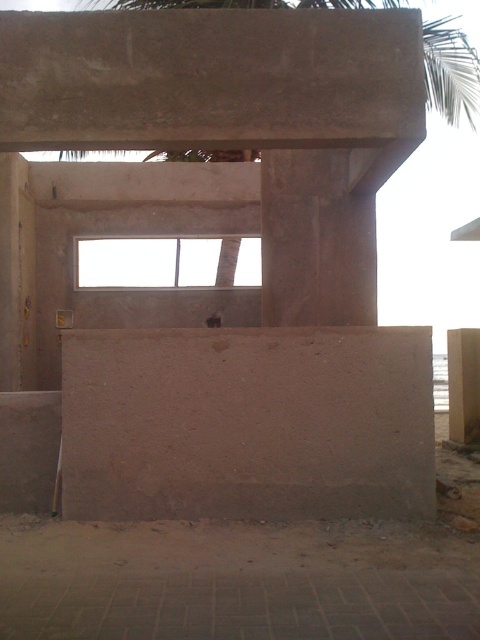
Which is above, smooth concrete wall at center or matte concrete window at center?

matte concrete window at center

Can you confirm if smooth concrete wall at center is smaller than matte concrete window at center?

No.

Image resolution: width=480 pixels, height=640 pixels. What do you see at coordinates (248, 422) in the screenshot?
I see `smooth concrete wall at center` at bounding box center [248, 422].

Identify the location of smooth concrete wall at center. (248, 422).

Can you confirm if green leafy palm tree at upper center is taller than brown concrete pillar at right?

Correct, green leafy palm tree at upper center is much taller as brown concrete pillar at right.

Can you confirm if green leafy palm tree at upper center is smaller than brown concrete pillar at right?

Actually, green leafy palm tree at upper center might be larger than brown concrete pillar at right.

Who is more forward, (x=469, y=96) or (x=456, y=378)?

Positioned in front is point (x=456, y=378).

You are a GUI agent. You are given a task and a screenshot of the screen. Output one action in this format:
    pyautogui.click(x=<x>, y=<y>)
    Task: Click on the green leafy palm tree at upper center
    
    Given the screenshot: What is the action you would take?
    pyautogui.click(x=451, y=72)

Which is above, smooth concrete wall at center or brown concrete pillar at right?

smooth concrete wall at center is higher up.

Does smooth concrete wall at center appear over brown concrete pillar at right?

Correct, smooth concrete wall at center is located above brown concrete pillar at right.

What are the coordinates of `smooth concrete wall at center` in the screenshot? It's located at (248, 422).